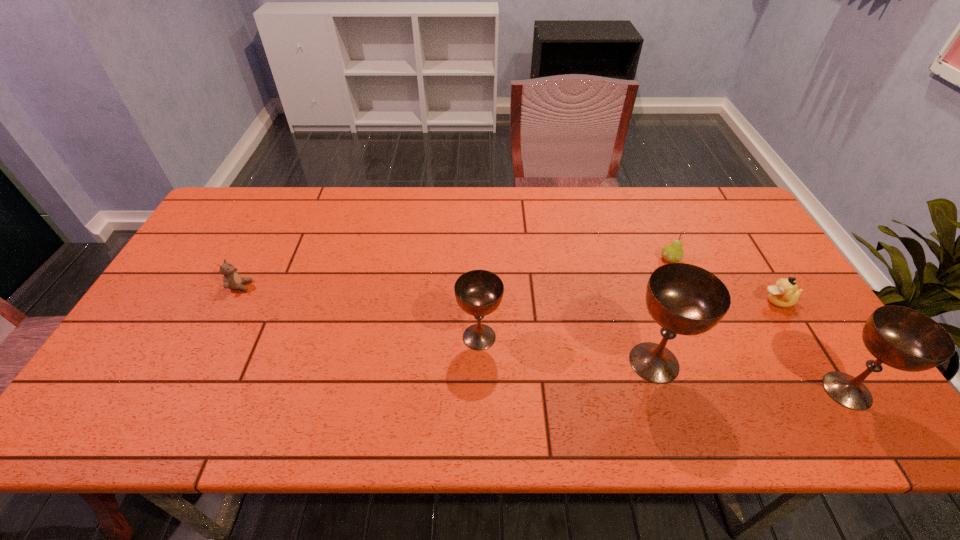
Where is `free spot located on the right of the third object from left to right`? The height and width of the screenshot is (540, 960). free spot located on the right of the third object from left to right is located at coordinates (818, 362).

Identify the location of vacant area situated on the back of the second tallest chalice. (x=758, y=253).

Identify the location of vacant space situated 0.110m on the front of the pear. (685, 294).

I want to click on free space located on the front-facing side of the leftmost object, so click(360, 286).

What are the coordinates of `vacant region located on the face of the duckling` in the screenshot? It's located at (634, 301).

You are a GUI agent. You are given a task and a screenshot of the screen. Output one action in this format:
    pyautogui.click(x=<x>, y=<y>)
    Task: Click on the vacant space located 0.270m on the face of the duckling
    This screenshot has width=960, height=540.
    Given the screenshot: What is the action you would take?
    (662, 301)

This screenshot has height=540, width=960. Find the location of `free point located on the face of the duckling`. free point located on the face of the duckling is located at coordinates (713, 301).

In order to click on chalice that is positioned at the right edge in this screenshot , I will do `click(902, 338)`.

Locate an element on the screen. The image size is (960, 540). duckling that is positioned at the right edge is located at coordinates (784, 293).

Identify the location of object at the near right corner. This screenshot has width=960, height=540. (902, 338).